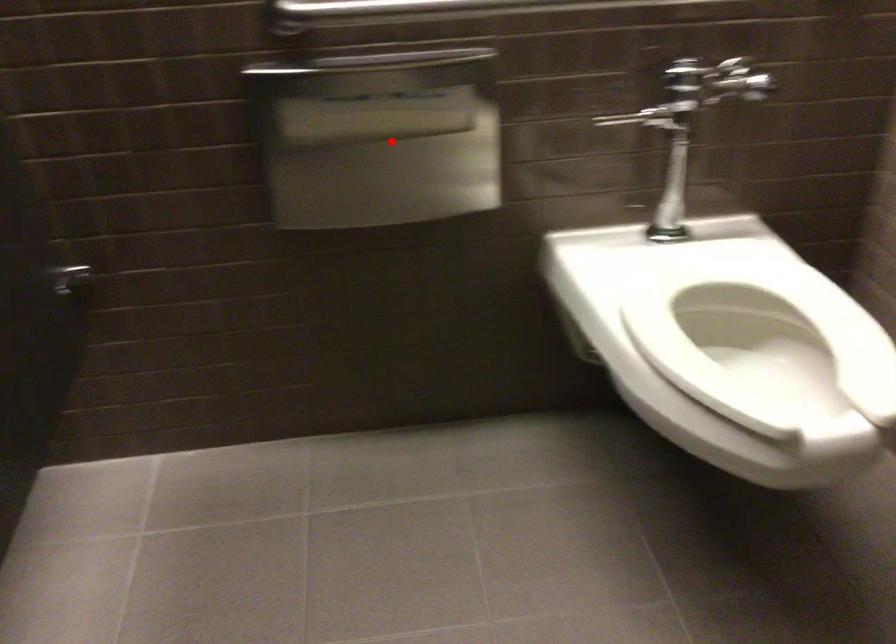
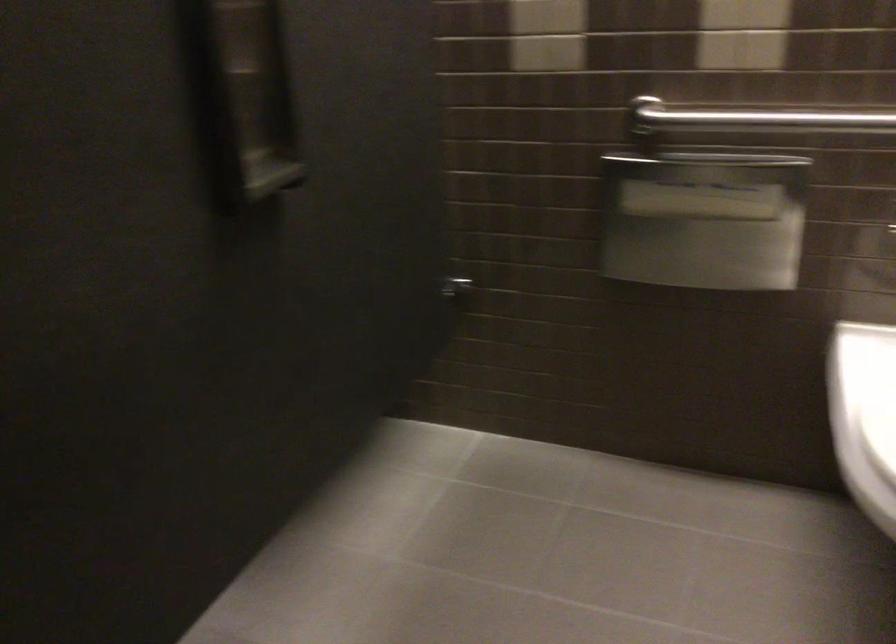
Question: I am providing you with two images of the same scene from different viewpoints. In image1, a red point is highlighted. Considering the same 3D point in image2, which of the following is correct?

Choices:
 (A) It is closer
 (B) It is farther

Answer: (B)